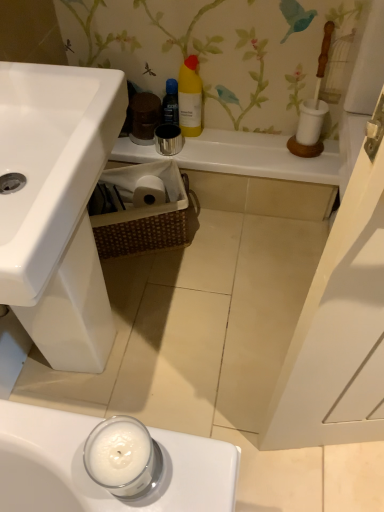
I want to click on free point in front of brown woven basket at lower center, so pos(156,285).